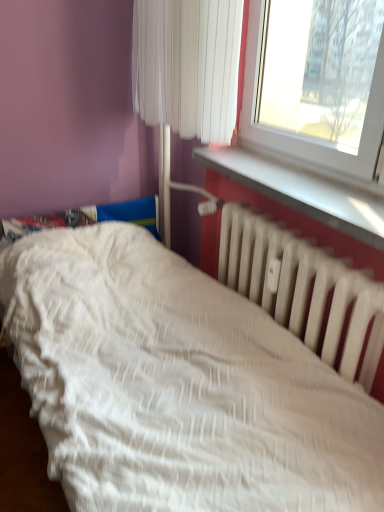
In order to face white matte radiator at lower right, should I rotate leftwards or rightwards?

A 12.444 degree turn to the right will do.

Describe the element at coordinates (187, 65) in the screenshot. I see `white fabric curtain at upper center` at that location.

Describe the element at coordinates (197, 368) in the screenshot. I see `white textured bed at lower left` at that location.

Locate an element on the screen. This screenshot has width=384, height=512. white plastic window sill at upper right is located at coordinates (302, 191).

The height and width of the screenshot is (512, 384). What are the coordinates of `white matte radiator at lower right` in the screenshot? It's located at (303, 287).

Does point (292, 196) appear closer or farther from the camera than point (354, 329)?

Point (292, 196) is positioned farther from the camera compared to point (354, 329).

From the image's perspective, which is below, white plastic window sill at upper right or white matte radiator at lower right?

white matte radiator at lower right appears lower in the image.

How much distance is there between white plastic window sill at upper right and white matte radiator at lower right?

white plastic window sill at upper right and white matte radiator at lower right are 8.64 inches apart from each other.

Is white plastic window sill at upper right oriented towards white matte radiator at lower right?

No, white plastic window sill at upper right is not aimed at white matte radiator at lower right.

Is point (196, 45) positioned in front of point (379, 248)?

Yes, it is in front of point (379, 248).

This screenshot has width=384, height=512. What are the coordinates of `window sill directly beneath the white fabric curtain at upper center (from a real-world perspective)` in the screenshot? It's located at (302, 191).

From a real-world perspective, is white fabric curtain at upper center over white plastic window sill at upper right?

Yes, from a real-world perspective, white fabric curtain at upper center is over white plastic window sill at upper right

Can you tell me how much white fabric curtain at upper center and white plastic window sill at upper right differ in facing direction?

They differ by 2.54 degrees in their facing directions.

Does white plastic window sill at upper right contain white textured bed at lower left?

No, white textured bed at lower left is located outside of white plastic window sill at upper right.

Who is smaller, white plastic window sill at upper right or white textured bed at lower left?

Smaller between the two is white plastic window sill at upper right.

Looking at this image, could you tell me if white plastic window sill at upper right is turned towards white textured bed at lower left?

No.

Consider the image. Is white matte radiator at lower right turned away from white textured bed at lower left?

Absolutely, white matte radiator at lower right is directed away from white textured bed at lower left.

Between white matte radiator at lower right and white textured bed at lower left, which one has less height?

white matte radiator at lower right is shorter.

From the image's perspective, between white matte radiator at lower right and white textured bed at lower left, which one is located above?

From the image's view, white matte radiator at lower right is above.

Does point (336, 276) come in front of point (235, 345)?

Yes, it is in front of point (235, 345).

Does white fabric curtain at upper center turn towards white textured bed at lower left?

No, white fabric curtain at upper center is not aimed at white textured bed at lower left.

From the image's perspective, does white fabric curtain at upper center appear higher than white textured bed at lower left?

Yes, from the image's perspective, white fabric curtain at upper center is over white textured bed at lower left.

Between point (202, 101) and point (134, 232), which one is positioned behind?

The point (134, 232) is farther.

Which is in front, white fabric curtain at upper center or white textured bed at lower left?

white textured bed at lower left is closer to the camera.

In terms of size, does white textured bed at lower left appear bigger or smaller than white matte radiator at lower right?

Clearly, white textured bed at lower left is larger in size than white matte radiator at lower right.

Is white textured bed at lower left directly adjacent to white matte radiator at lower right?

They are not placed beside each other.

Is white textured bed at lower left taller or shorter than white fabric curtain at upper center?

white textured bed at lower left is taller than white fabric curtain at upper center.

Can you tell me how much white textured bed at lower left and white fabric curtain at upper center differ in facing direction?

93.3 degrees separate the facing orientations of white textured bed at lower left and white fabric curtain at upper center.

Based on the photo, is white fabric curtain at upper center inside white textured bed at lower left?

Actually, white fabric curtain at upper center is outside white textured bed at lower left.

Is white textured bed at lower left closer to the viewer compared to white fabric curtain at upper center?

Yes, it is in front of white fabric curtain at upper center.

Locate an element on the screen. The width and height of the screenshot is (384, 512). radiator below the white plastic window sill at upper right (from the image's perspective) is located at coordinates (303, 287).

Where is `curtain behind the white plastic window sill at upper right`? This screenshot has height=512, width=384. curtain behind the white plastic window sill at upper right is located at coordinates (187, 65).

Which object lies further to the anchor point white fabric curtain at upper center, white textured bed at lower left or white plastic window sill at upper right?

white textured bed at lower left is positioned further to the anchor white fabric curtain at upper center.

From the image, which object appears to be farther from white matte radiator at lower right, white textured bed at lower left or white fabric curtain at upper center?

Among the two, white fabric curtain at upper center is located further to white matte radiator at lower right.

From the picture: When comparing their distances from white matte radiator at lower right, does white textured bed at lower left or white plastic window sill at upper right seem closer?

white plastic window sill at upper right is closer to white matte radiator at lower right.

Estimate the real-world distances between objects in this image. Which object is further from white plastic window sill at upper right, white fabric curtain at upper center or white matte radiator at lower right?

white fabric curtain at upper center.

Considering their positions, is white plastic window sill at upper right positioned further to white matte radiator at lower right than white textured bed at lower left?

Based on the image, white textured bed at lower left appears to be further to white matte radiator at lower right.

Estimate the real-world distances between objects in this image. Which object is closer to white textured bed at lower left, white fabric curtain at upper center or white matte radiator at lower right?

white matte radiator at lower right lies closer to white textured bed at lower left than the other object.

Based on their spatial positions, is white textured bed at lower left or white fabric curtain at upper center closer to white plastic window sill at upper right?

white fabric curtain at upper center is positioned closer to the anchor white plastic window sill at upper right.

Estimate the real-world distances between objects in this image. Which object is closer to white fabric curtain at upper center, white matte radiator at lower right or white textured bed at lower left?

Among the two, white matte radiator at lower right is located nearer to white fabric curtain at upper center.

The height and width of the screenshot is (512, 384). Find the location of `window sill between white textured bed at lower left and white matte radiator at lower right in the front-back direction`. window sill between white textured bed at lower left and white matte radiator at lower right in the front-back direction is located at coordinates (302, 191).

You are a GUI agent. You are given a task and a screenshot of the screen. Output one action in this format:
    pyautogui.click(x=<x>, y=<y>)
    Task: Click on the radiator between white fabric curtain at upper center and white textured bed at lower left in the up-down direction
    
    Given the screenshot: What is the action you would take?
    coord(303,287)

Find the location of `window sill between white fabric curtain at upper center and white textured bed at lower left in the vertical direction`. window sill between white fabric curtain at upper center and white textured bed at lower left in the vertical direction is located at coordinates (302, 191).

Locate an element on the screen. The width and height of the screenshot is (384, 512). window sill between white fabric curtain at upper center and white matte radiator at lower right vertically is located at coordinates (302, 191).